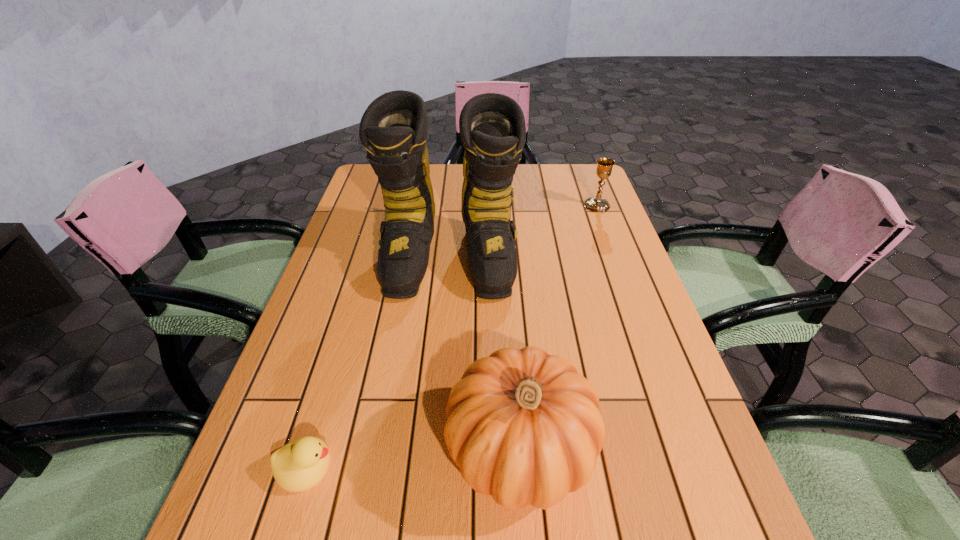
The height and width of the screenshot is (540, 960). Find the location of `the second farthest object`. the second farthest object is located at coordinates (393, 129).

Find the location of a particular element. The height and width of the screenshot is (540, 960). ski boots is located at coordinates (393, 129).

At what (x,y) coordinates should I click in order to perform the action: click on pumpkin. Please return your answer as a coordinate pair (x, y). Looking at the image, I should click on (524, 427).

Locate an element on the screen. The image size is (960, 540). the farthest object is located at coordinates (604, 165).

Where is `the third tallest object`? the third tallest object is located at coordinates (604, 165).

The image size is (960, 540). In order to click on duckling in this screenshot , I will do `click(298, 466)`.

Where is `vacant space located 0.120m on the front of the tallest object`? vacant space located 0.120m on the front of the tallest object is located at coordinates (442, 343).

This screenshot has height=540, width=960. Find the location of `vacant space positioned on the left of the third shortest object`. vacant space positioned on the left of the third shortest object is located at coordinates (329, 450).

Identify the location of vacant region located on the front of the chalice. This screenshot has width=960, height=540. (606, 227).

In order to click on free space located on the face of the shortest object in this screenshot , I will do `click(533, 468)`.